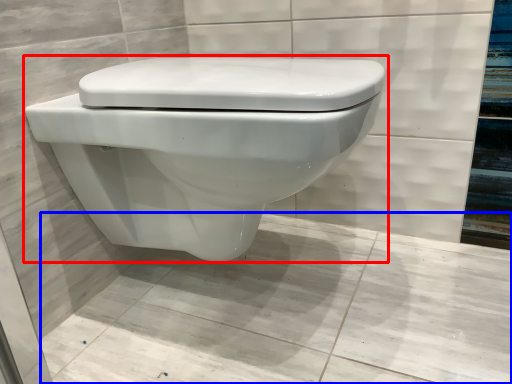
Question: Which object is closer to the camera taking this photo, toilet (highlighted by a red box) or concrete (highlighted by a blue box)?

Choices:
 (A) toilet
 (B) concrete

Answer: (B)